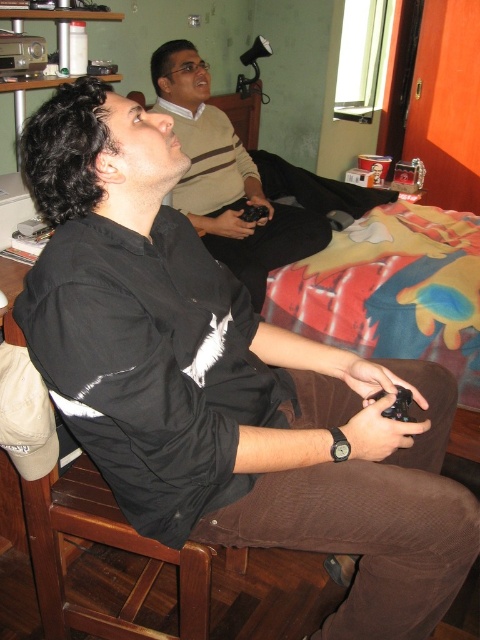
Question: Does black matte shirt at upper left have a larger size compared to black matte game controller at lower center?

Choices:
 (A) yes
 (B) no

Answer: (A)

Question: Does black matte shirt at upper left come behind black matte game controller at lower center?

Choices:
 (A) yes
 (B) no

Answer: (A)

Question: Can you confirm if black matte shirt at upper left is wider than black matte game controller at lower center?

Choices:
 (A) yes
 (B) no

Answer: (A)

Question: Which point is farther from the camera taking this photo?

Choices:
 (A) (406, 394)
 (B) (189, 115)

Answer: (B)

Question: Which point is farther to the camera?

Choices:
 (A) (381, 397)
 (B) (240, 189)

Answer: (B)